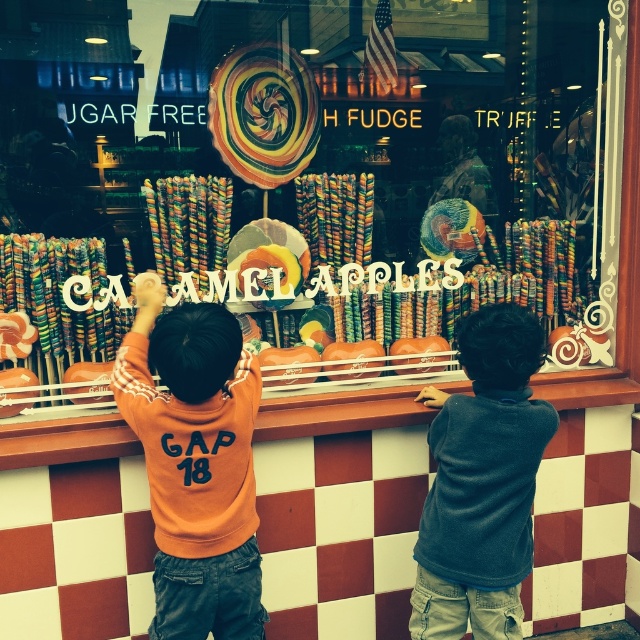
Does dark gray sweater at center have a larger size compared to shiny metallic lollipop at center?

Indeed, dark gray sweater at center has a larger size compared to shiny metallic lollipop at center.

Is point (524, 540) positioned before point (460, 221)?

Yes.

Locate an element on the screen. This screenshot has height=640, width=640. dark gray sweater at center is located at coordinates (481, 483).

Is dark gray sweater at center bigger than swirled glass lollipop at center?

Indeed, dark gray sweater at center has a larger size compared to swirled glass lollipop at center.

Which is more to the right, dark gray sweater at center or swirled glass lollipop at center?

dark gray sweater at center is more to the right.

Identify the location of dark gray sweater at center. The image size is (640, 640). (481, 483).

Find the location of a particular element. This screenshot has width=640, height=640. dark gray sweater at center is located at coordinates (481, 483).

In order to click on orange fleece sweatshirt at left in this screenshot , I will do `click(195, 465)`.

Can you confirm if orange fleece sweatshirt at left is shorter than shiny metallic lollipop at center?

In fact, orange fleece sweatshirt at left may be taller than shiny metallic lollipop at center.

Where is `orange fleece sweatshirt at left`? The width and height of the screenshot is (640, 640). orange fleece sweatshirt at left is located at coordinates (195, 465).